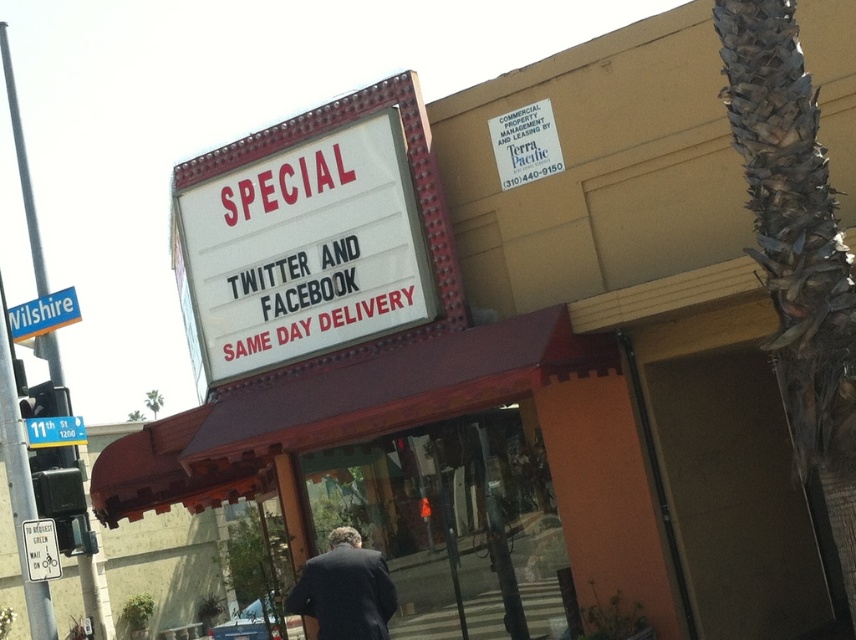
You are a delivery driver who needs to park your vehicle between the marquee sign and the white plastic street sign at lower left. The vehicle is 5 meters long. Is there enough space between them to park?

The distance between the marquee sign and the white plastic street sign at lower left is 8.75 meters. Since the vehicle is 5 meters long, there is sufficient space to park between them.

You are designing a new sign for the storefront and want to place a new decorative element between the two existing signs. Given that the white plastic marquee sign at upper center is wider than the white matte sign at upper center, where should you position the new element to ensure it is centered between them?

The new decorative element should be positioned closer to the white plastic marquee sign at upper center since it is wider than the white matte sign at upper center, ensuring the center point between them is balanced.

You are standing in front of the storefront and want to take a photo. You notice two points marked on the image at coordinates point (x=28, y=336) and point (x=51, y=564). Which point should you focus on to ensure it appears closer in your photo?

Point (x=28, y=336) is further to the camera than point (x=51, y=564), so focusing on point (x=28, y=336) will make it appear closer in the photo.